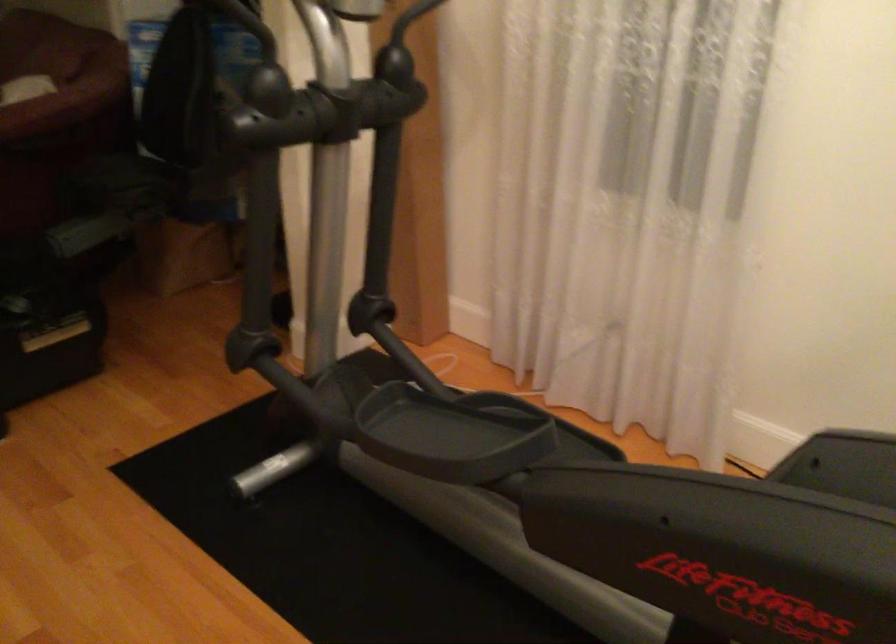
The first image is from the beginning of the video and the second image is from the end. How did the camera likely rotate when shooting the video?

The rotation direction of the camera is left-down.